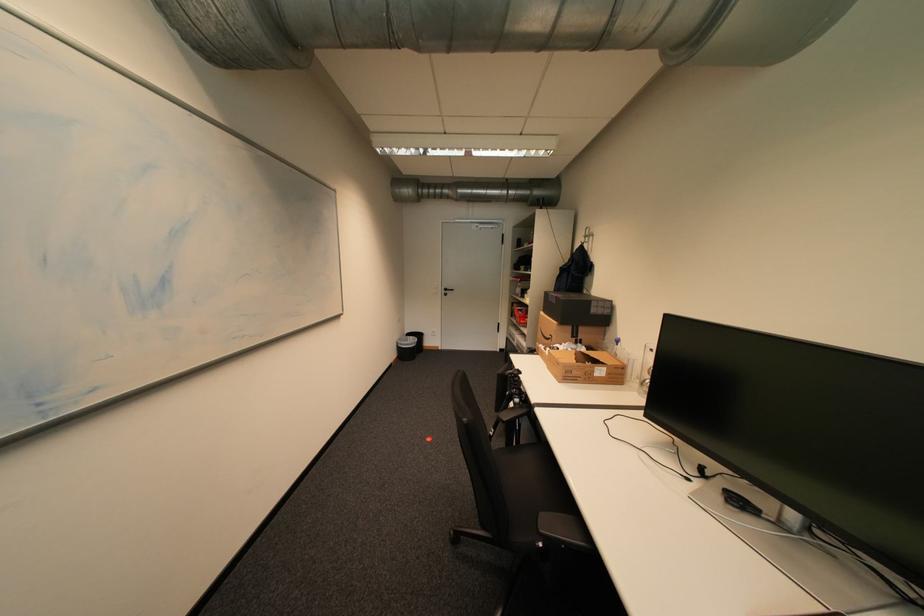
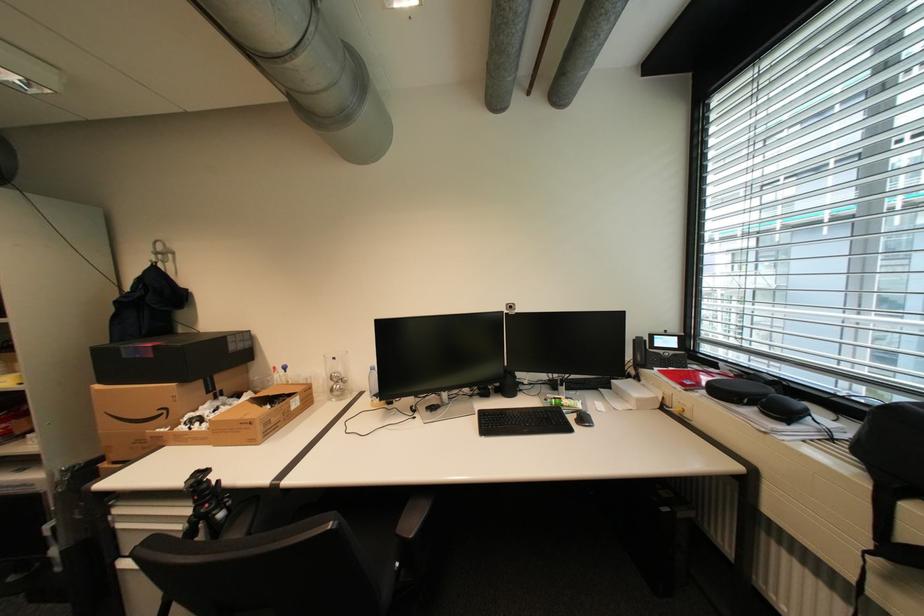
Where in the second image is the point corresponding to [525,379] from the first image?

(213, 485)